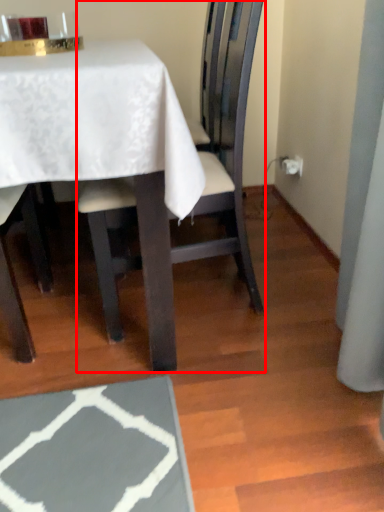
Question: In this image, where is chair (annotated by the red box) located relative to table?

Choices:
 (A) left
 (B) right

Answer: (B)